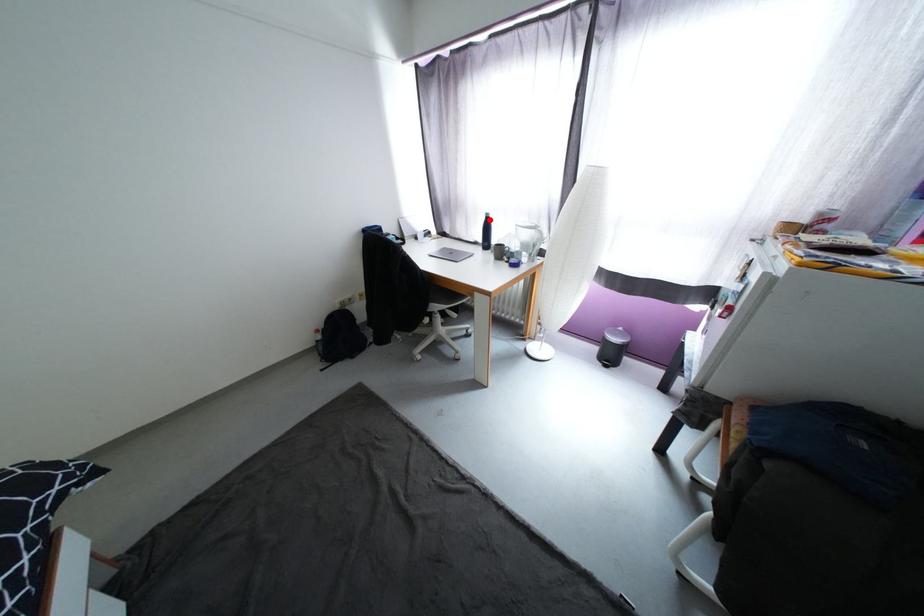
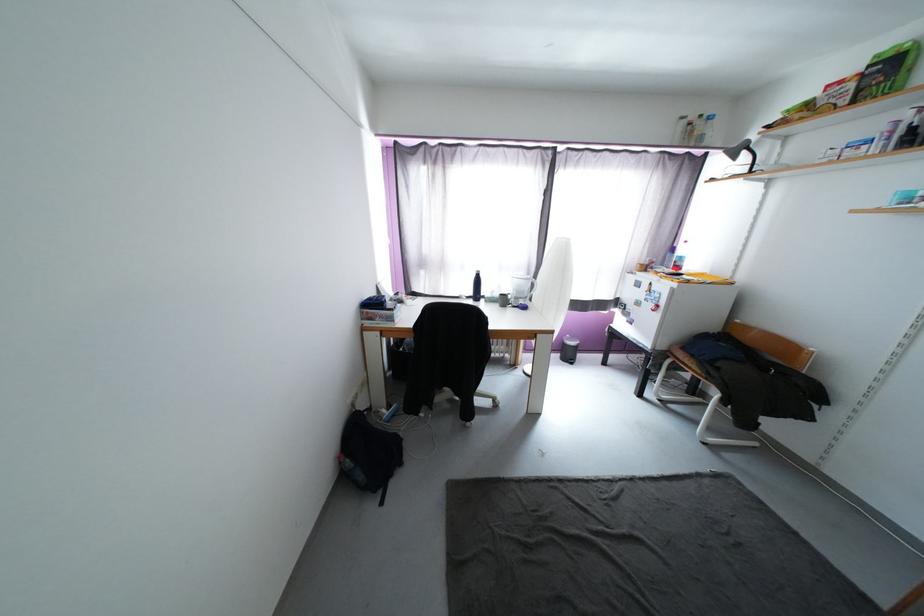
Question: I am providing you with two images of the same scene from different viewpoints. In image1, a red point is highlighted. Considering the same 3D point in image2, which of the following is correct?

Choices:
 (A) It is closer
 (B) It is farther

Answer: (B)